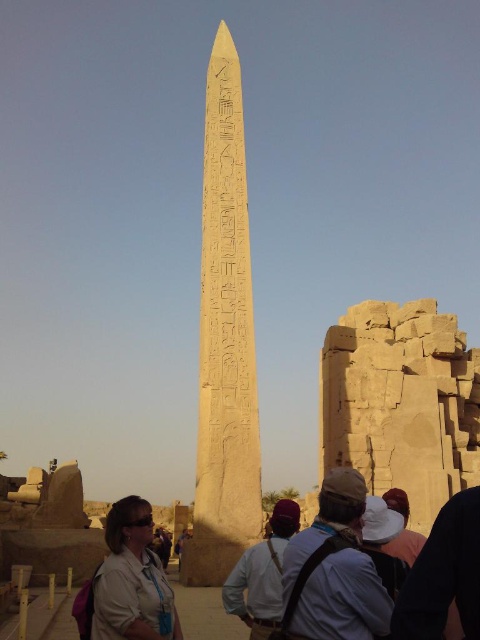
Question: Which object is the closest to the yellow sandstone obelisk at center?

Choices:
 (A) yellow stone blocks at center
 (B) white cotton hat at center
 (C) white fabric hat at center
 (D) matte beige shirt at lower left

Answer: (C)

Question: Among these objects, which one is farthest from the camera?

Choices:
 (A) yellow stone blocks at center
 (B) white cotton shirt at lower center

Answer: (A)

Question: Is white cotton shirt at center positioned before white cotton hat at center?

Choices:
 (A) no
 (B) yes

Answer: (B)

Question: Can you confirm if white cotton shirt at center is positioned above white fabric hat at center?

Choices:
 (A) yes
 (B) no

Answer: (B)

Question: Which object appears farthest from the camera in this image?

Choices:
 (A) white cotton shirt at lower center
 (B) white fabric hat at center
 (C) white cotton shirt at center
 (D) white cotton hat at center

Answer: (D)

Question: Is yellow stone blocks at center positioned behind white cotton hat at center?

Choices:
 (A) yes
 (B) no

Answer: (A)